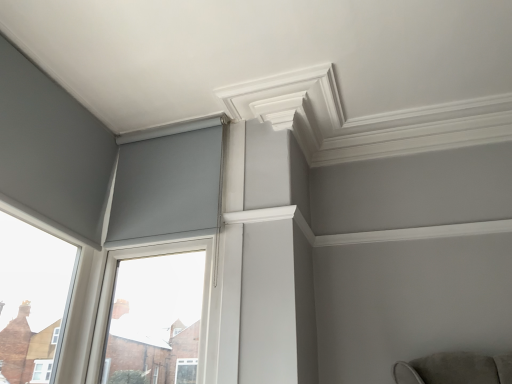
This screenshot has height=384, width=512. What do you see at coordinates (167, 187) in the screenshot? I see `matte gray roller blind at upper center` at bounding box center [167, 187].

You are a GUI agent. You are given a task and a screenshot of the screen. Output one action in this format:
    pyautogui.click(x=<x>, y=<y>)
    Task: Click on the matte gray roller blind at upper center
    
    Given the screenshot: What is the action you would take?
    pyautogui.click(x=167, y=187)

Image resolution: width=512 pixels, height=384 pixels. In order to click on matte gray roller blind at upper center in this screenshot , I will do `click(167, 187)`.